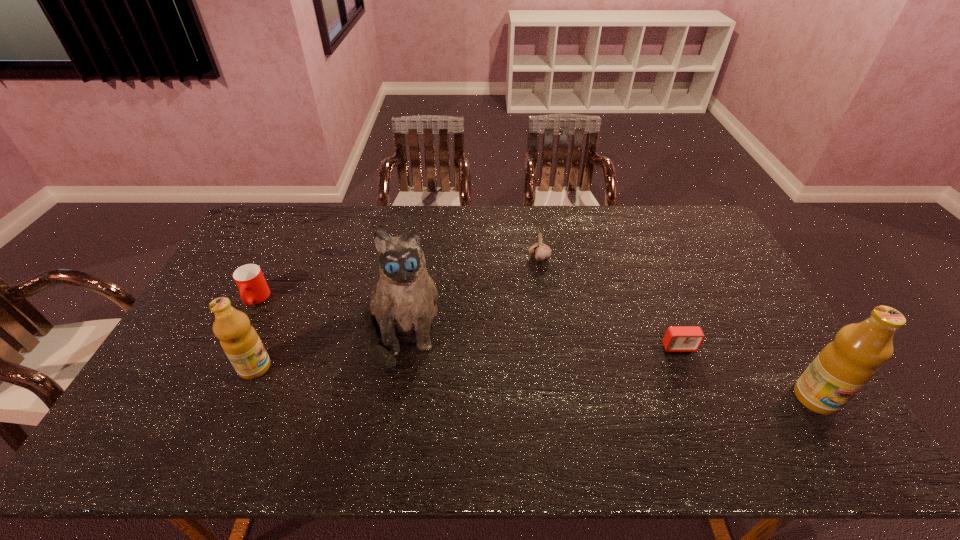
This screenshot has height=540, width=960. In the image, there is a desktop. What are the coordinates of `free region at the near edge` in the screenshot? It's located at (689, 387).

Where is `vacant space at the left edge of the desktop`? Image resolution: width=960 pixels, height=540 pixels. vacant space at the left edge of the desktop is located at coordinates (206, 303).

Locate an element on the screen. free location at the right edge of the desktop is located at coordinates (766, 367).

Find the location of a particular element. The width and height of the screenshot is (960, 540). vacant region at the far left corner of the desktop is located at coordinates (276, 222).

This screenshot has height=540, width=960. Identify the location of vacant space at the near right corner. point(796,408).

Identify the location of free area in between the shortest object and the third object from right to left. The width and height of the screenshot is (960, 540). (609, 302).

This screenshot has width=960, height=540. In order to click on free space between the fifth object from left to right and the fourth object from right to left in this screenshot , I will do `click(540, 339)`.

Identify the location of free space between the cup and the taller olive oil. (536, 348).

What are the coordinates of `empty location between the fourth object from right to left and the shorter olive oil` in the screenshot? It's located at (328, 349).

You are a GUI agent. You are given a task and a screenshot of the screen. Output one action in this format:
    pyautogui.click(x=<x>, y=<y>)
    Task: Click on the vacant region between the alarm clock and the fourth object from left to right
    
    Given the screenshot: What is the action you would take?
    pyautogui.click(x=609, y=302)